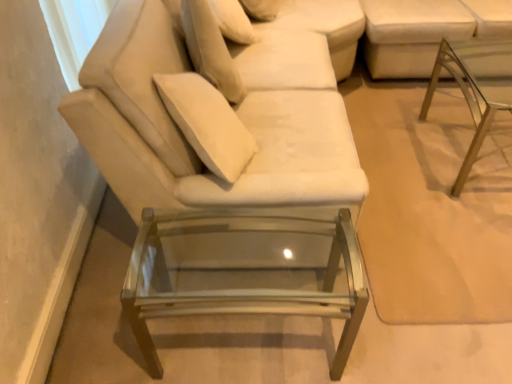
Question: Is the surface of velvet beige pillow at upper center in direct contact with clear glass table at lower center, which is the 2th table in right-to-left order?

Choices:
 (A) no
 (B) yes

Answer: (A)

Question: Could you tell me if velvet beige pillow at upper center is turned towards clear glass table at lower center, which is the second table from back to front?

Choices:
 (A) yes
 (B) no

Answer: (B)

Question: Can you confirm if velvet beige pillow at upper center is shorter than clear glass table at lower center, which is the 1th table from bottom to top?

Choices:
 (A) yes
 (B) no

Answer: (A)

Question: Does velvet beige pillow at upper center appear on the right side of clear glass table at lower center, which is the 2th table in right-to-left order?

Choices:
 (A) no
 (B) yes

Answer: (A)

Question: Is velvet beige pillow at upper center outside clear glass table at lower center, which is the 1th table from bottom to top?

Choices:
 (A) yes
 (B) no

Answer: (A)

Question: Choose the correct answer: Is transparent glass table at right, marked as the 2th table in a left-to-right arrangement, inside white fabric couch at upper right or outside it?

Choices:
 (A) inside
 (B) outside

Answer: (B)

Question: From the image's perspective, is transparent glass table at right, which ranks as the 1th table in right-to-left order, above or below white fabric couch at upper right?

Choices:
 (A) below
 (B) above

Answer: (A)

Question: Considering the positions of transparent glass table at right, marked as the first table in a top-to-bottom arrangement, and white fabric couch at upper right in the image, is transparent glass table at right, marked as the first table in a top-to-bottom arrangement, wider or thinner than white fabric couch at upper right?

Choices:
 (A) thin
 (B) wide

Answer: (A)

Question: Considering the relative positions of transparent glass table at right, placed as the second table when sorted from bottom to top, and white fabric couch at upper right in the image provided, is transparent glass table at right, placed as the second table when sorted from bottom to top, to the left or to the right of white fabric couch at upper right?

Choices:
 (A) right
 (B) left

Answer: (B)

Question: Based on their sizes in the image, would you say velvet beige pillow at upper center is bigger or smaller than velvet beige couch at center?

Choices:
 (A) small
 (B) big

Answer: (A)

Question: From their relative heights in the image, would you say velvet beige pillow at upper center is taller or shorter than velvet beige couch at center?

Choices:
 (A) short
 (B) tall

Answer: (A)

Question: From a real-world perspective, is velvet beige pillow at upper center positioned above or below velvet beige couch at center?

Choices:
 (A) below
 (B) above

Answer: (B)

Question: Looking at their shapes, would you say velvet beige pillow at upper center is wider or thinner than velvet beige couch at center?

Choices:
 (A) wide
 (B) thin

Answer: (B)

Question: Is point (493, 84) closer or farther from the camera than point (267, 268)?

Choices:
 (A) closer
 (B) farther

Answer: (B)

Question: In the image, is transparent glass table at right, which ranks as the 1th table in right-to-left order, positioned in front of or behind clear glass table at lower center, which appears as the second table when viewed from the top?

Choices:
 (A) front
 (B) behind

Answer: (B)